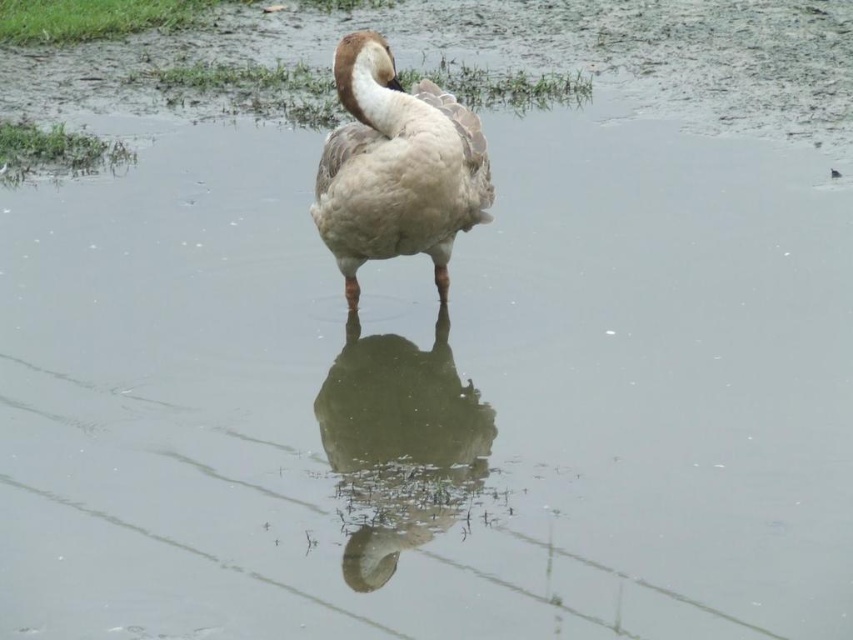
Question: Which of the following is the farthest from the observer?

Choices:
 (A) (332, 220)
 (B) (381, 499)

Answer: (A)

Question: Among these objects, which one is farthest from the camera?

Choices:
 (A) brown feathered duck at center
 (B) brown matte duck at center

Answer: (A)

Question: Is the position of brown matte duck at center more distant than that of brown feathered duck at center?

Choices:
 (A) no
 (B) yes

Answer: (A)

Question: Does brown matte duck at center have a lesser width compared to brown feathered duck at center?

Choices:
 (A) yes
 (B) no

Answer: (A)

Question: Does brown matte duck at center appear under brown feathered duck at center?

Choices:
 (A) no
 (B) yes

Answer: (B)